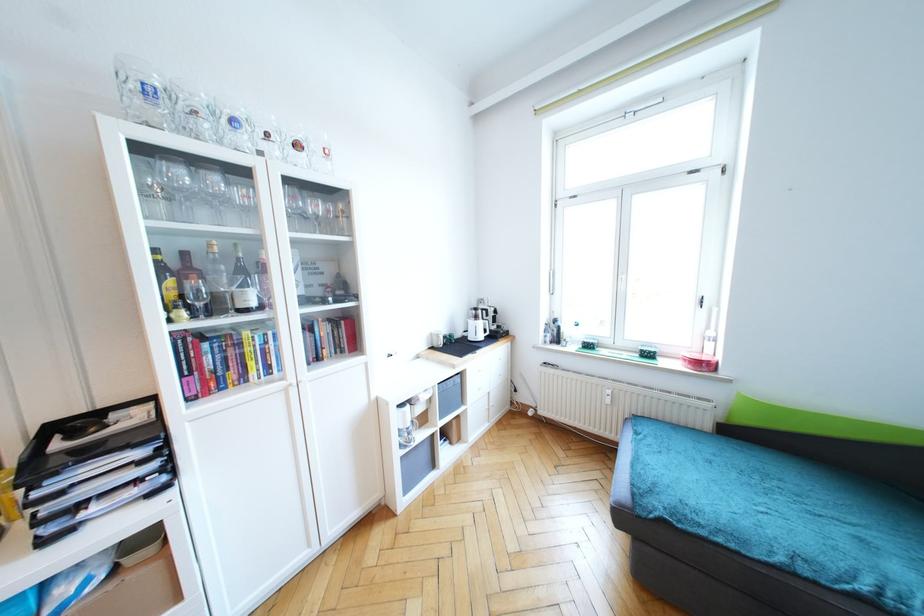
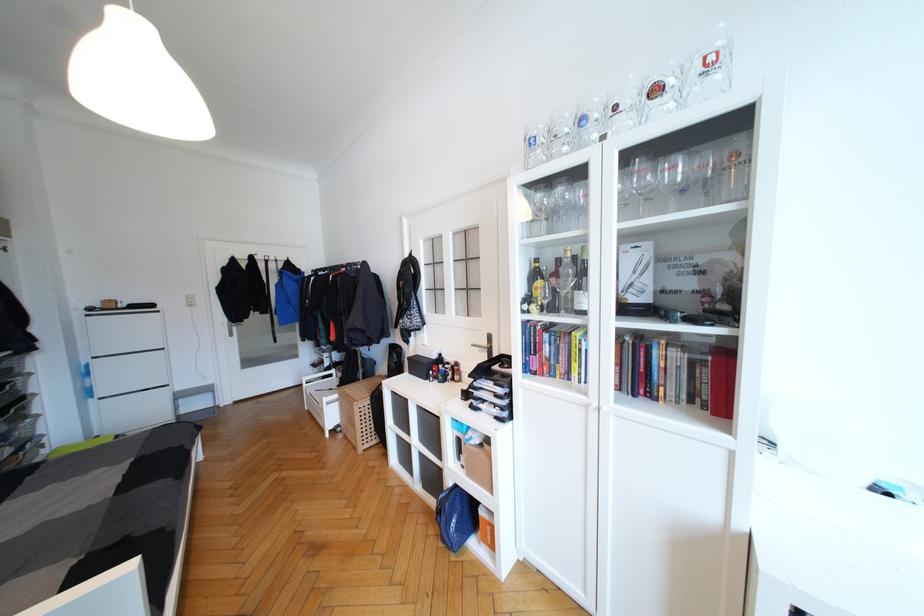
Where in the second image is the point corresponding to (x=320, y=208) from the first image?

(679, 171)